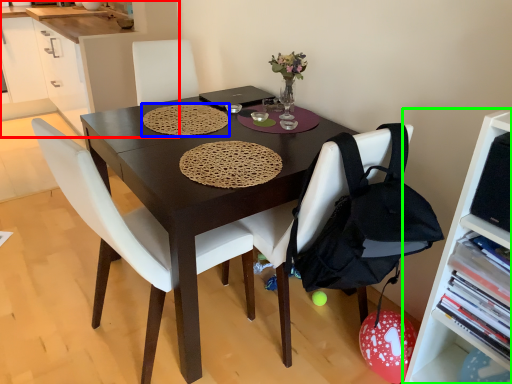
Question: Considering the real-world distances, which object is farthest from cabinetry (highlighted by a red box)? mat (highlighted by a blue box) or shelf (highlighted by a green box)?

Choices:
 (A) mat
 (B) shelf

Answer: (B)